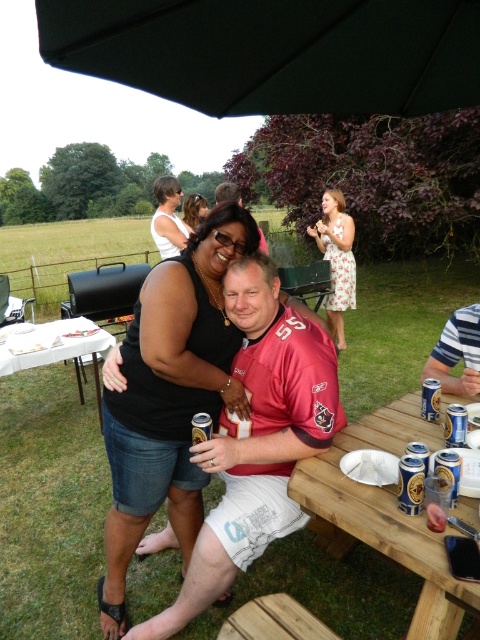
Question: Is striped polo shirt at right positioned at the back of metallic can at table right?

Choices:
 (A) no
 (B) yes

Answer: (B)

Question: Which of the following is the closest to the observer?

Choices:
 (A) white plastic table at lower left
 (B) matte black tank top at upper center
 (C) floral dress at upper right

Answer: (A)

Question: Does striped polo shirt at right appear on the right side of white matte tank top at upper left?

Choices:
 (A) no
 (B) yes

Answer: (B)

Question: Among these points, which one is farthest from the camera?

Choices:
 (A) (236, 195)
 (B) (177, 253)

Answer: (A)

Question: Which point appears closest to the camera in this image?

Choices:
 (A) (323, 195)
 (B) (162, 250)
 (C) (440, 460)
 (D) (477, 328)

Answer: (C)

Question: Is matte red jersey at center thinner than white matte tank top at upper left?

Choices:
 (A) no
 (B) yes

Answer: (A)